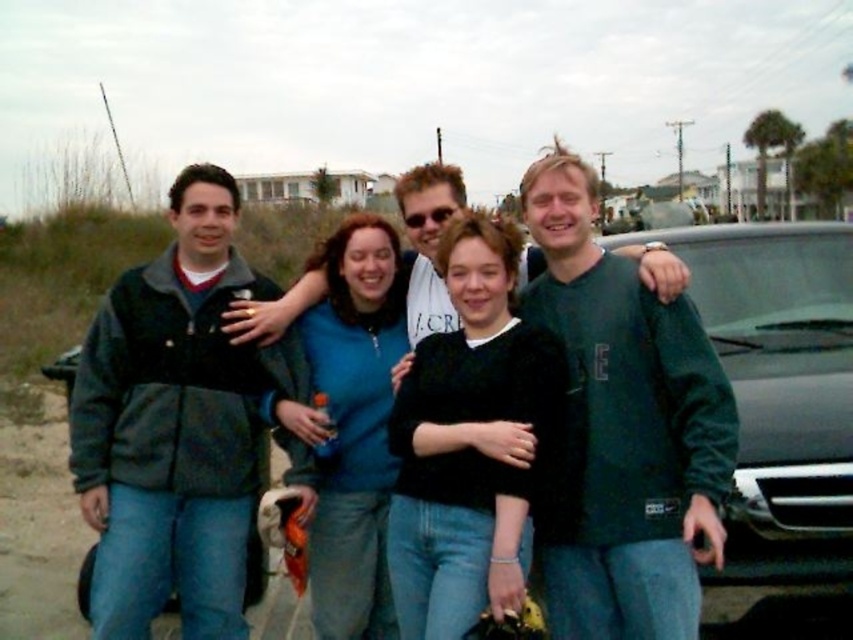
Based on the photo, who is higher up, dark gray fleece sweatshirt at center or matte black jacket at center?

matte black jacket at center is above.

Can you confirm if dark gray fleece sweatshirt at center is taller than matte black jacket at center?

No.

Who is more forward, (692,344) or (569,500)?

Positioned in front is point (692,344).

Locate an element on the screen. This screenshot has height=640, width=853. dark gray fleece sweatshirt at center is located at coordinates (624, 428).

Does dark gray fleece jacket at left have a greater height compared to matte black jacket at center?

Correct, dark gray fleece jacket at left is much taller as matte black jacket at center.

Which of these two, dark gray fleece jacket at left or matte black jacket at center, stands taller?

Answer: dark gray fleece jacket at left is taller.

Locate an element on the screen. dark gray fleece jacket at left is located at coordinates (173, 428).

Locate an element on the screen. dark gray fleece jacket at left is located at coordinates (173, 428).

Does dark gray fleece jacket at left appear over dark gray fleece sweatshirt at center?

Correct, dark gray fleece jacket at left is located above dark gray fleece sweatshirt at center.

Between point (132, 419) and point (628, 483), which one is positioned in front?

Positioned in front is point (628, 483).

Find the location of a particular element. dark gray fleece jacket at left is located at coordinates (173, 428).